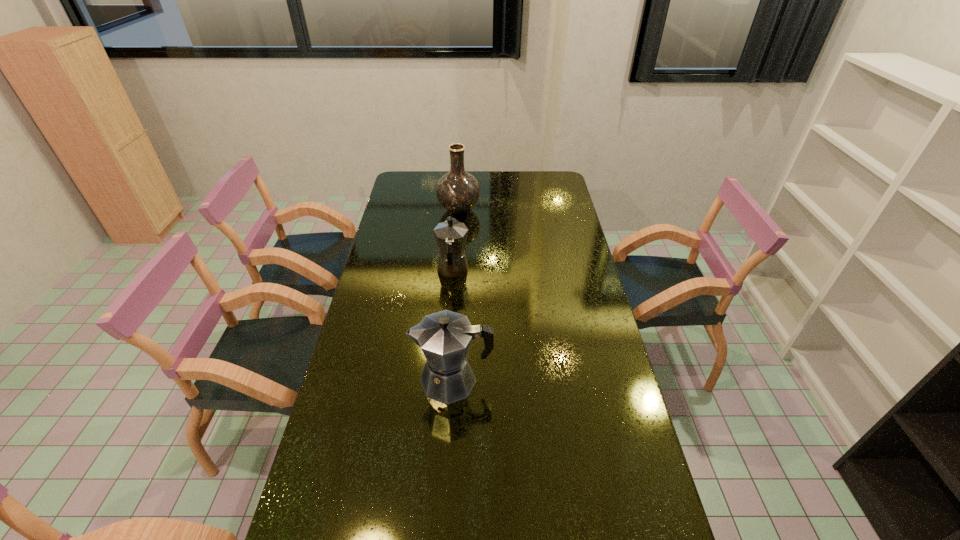
In the image, there is a desktop. Where is `free space at the far edge`? The height and width of the screenshot is (540, 960). free space at the far edge is located at coordinates (477, 176).

Locate an element on the screen. This screenshot has width=960, height=540. vacant position at the left edge of the desktop is located at coordinates (354, 422).

Where is `vacant space at the right edge of the desktop`? The width and height of the screenshot is (960, 540). vacant space at the right edge of the desktop is located at coordinates (575, 239).

You are a GUI agent. You are given a task and a screenshot of the screen. Output one action in this format:
    pyautogui.click(x=<x>, y=<y>)
    Task: Click on the blank space at the far left corner of the desktop
    The height and width of the screenshot is (540, 960).
    Given the screenshot: What is the action you would take?
    pyautogui.click(x=422, y=174)

In the image, there is a desktop. Identify the location of free region at the far right corner. (551, 187).

Find the location of a particular element. vacant space that's between the farthest object and the nearer coffeepot is located at coordinates (456, 295).

Where is `unoccupied position between the nearer coffeepot and the vase`? Image resolution: width=960 pixels, height=540 pixels. unoccupied position between the nearer coffeepot and the vase is located at coordinates (456, 295).

Identify the location of vacant space that is in between the farthest object and the nearest object. (456, 295).

The height and width of the screenshot is (540, 960). I want to click on free spot between the nearest object and the vase, so tap(456, 295).

In order to click on object that stands as the second closest to the farthest object in this screenshot , I will do tap(444, 337).